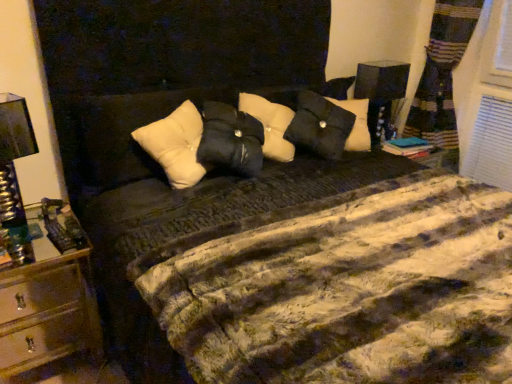
Question: Is metallic silver lamp at left, marked as the first bedside lamp in a bottom-to-top arrangement, outside black fabric lampshade at upper right, which is counted as the second bedside lamp, starting from the bottom?

Choices:
 (A) no
 (B) yes

Answer: (B)

Question: From a real-world perspective, is metallic silver lamp at left, marked as the second bedside lamp in a right-to-left arrangement, positioned under black fabric lampshade at upper right, arranged as the first bedside lamp when viewed from the right, based on gravity?

Choices:
 (A) yes
 (B) no

Answer: (B)

Question: Does metallic silver lamp at left, which is the first bedside lamp in left-to-right order, have a greater height compared to black fabric lampshade at upper right, arranged as the first bedside lamp when viewed from the right?

Choices:
 (A) no
 (B) yes

Answer: (A)

Question: Does metallic silver lamp at left, which ranks as the 2th bedside lamp in back-to-front order, have a lesser width compared to black fabric lampshade at upper right, the second bedside lamp when ordered from front to back?

Choices:
 (A) yes
 (B) no

Answer: (B)

Question: Does metallic silver lamp at left, marked as the first bedside lamp in a bottom-to-top arrangement, have a greater width compared to black fabric lampshade at upper right, the first bedside lamp from the top?

Choices:
 (A) no
 (B) yes

Answer: (B)

Question: Considering the relative sizes of metallic silver lamp at left, which ranks as the 2th bedside lamp in back-to-front order, and black fabric lampshade at upper right, the second bedside lamp when ordered from front to back, in the image provided, is metallic silver lamp at left, which ranks as the 2th bedside lamp in back-to-front order, shorter than black fabric lampshade at upper right, the second bedside lamp when ordered from front to back,?

Choices:
 (A) no
 (B) yes

Answer: (B)

Question: Are metallic silver lamp at left, marked as the first bedside lamp in a bottom-to-top arrangement, and white soft pillow at center making contact?

Choices:
 (A) yes
 (B) no

Answer: (B)

Question: From the image's perspective, does metallic silver lamp at left, which is the second bedside lamp in top-to-bottom order, appear higher than white soft pillow at center?

Choices:
 (A) no
 (B) yes

Answer: (A)

Question: Is metallic silver lamp at left, marked as the first bedside lamp in a bottom-to-top arrangement, to the right of white soft pillow at center from the viewer's perspective?

Choices:
 (A) yes
 (B) no

Answer: (B)

Question: Considering the relative sizes of metallic silver lamp at left, placed as the 1th bedside lamp when sorted from front to back, and white soft pillow at center in the image provided, is metallic silver lamp at left, placed as the 1th bedside lamp when sorted from front to back, wider than white soft pillow at center?

Choices:
 (A) no
 (B) yes

Answer: (A)

Question: From the image's perspective, is metallic silver lamp at left, placed as the 1th bedside lamp when sorted from front to back, under white soft pillow at center?

Choices:
 (A) no
 (B) yes

Answer: (B)

Question: Considering the relative positions of metallic silver lamp at left, marked as the second bedside lamp in a right-to-left arrangement, and white soft pillow at center in the image provided, is metallic silver lamp at left, marked as the second bedside lamp in a right-to-left arrangement, to the left of white soft pillow at center from the viewer's perspective?

Choices:
 (A) no
 (B) yes

Answer: (B)

Question: Is white soft pillow at center bigger than metallic gold nightstand at left?

Choices:
 (A) no
 (B) yes

Answer: (A)